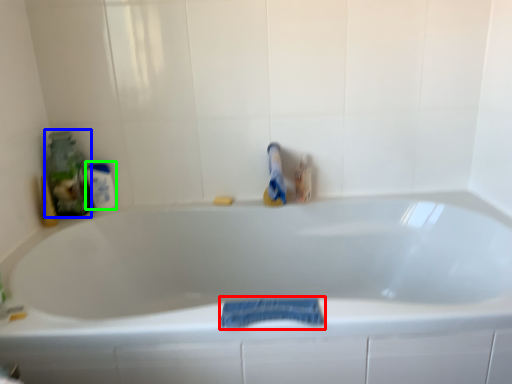
Question: Considering the real-world distances, which object is farthest from bath towel (highlighted by a red box)? cleaning product (highlighted by a blue box) or mouthwash (highlighted by a green box)?

Choices:
 (A) cleaning product
 (B) mouthwash

Answer: (A)